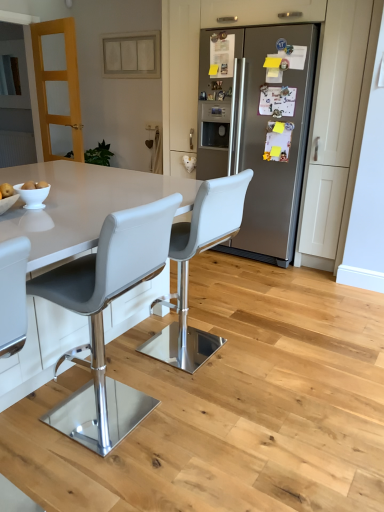
Question: Is the depth of satin silver refrigerator at center less than that of white leather stool at center, which appears as the 1th chair when viewed from the back?

Choices:
 (A) yes
 (B) no

Answer: (B)

Question: Are satin silver refrigerator at center and white leather stool at center, which appears as the 1th chair when viewed from the back, far apart?

Choices:
 (A) yes
 (B) no

Answer: (A)

Question: Can you confirm if satin silver refrigerator at center is positioned to the right of white leather stool at center, which appears as the 1th chair when viewed from the back?

Choices:
 (A) yes
 (B) no

Answer: (A)

Question: Does satin silver refrigerator at center touch white leather stool at center, which appears as the 1th chair when viewed from the back?

Choices:
 (A) no
 (B) yes

Answer: (A)

Question: Is satin silver refrigerator at center shorter than white leather stool at center, which is the 2th chair in front-to-back order?

Choices:
 (A) no
 (B) yes

Answer: (A)

Question: From the image's perspective, is satin silver refrigerator at center beneath white leather stool at center, which appears as the 1th chair when viewed from the back?

Choices:
 (A) no
 (B) yes

Answer: (A)

Question: From a real-world perspective, is white glossy bowl at lower left under yellow matte apple at lower left?

Choices:
 (A) no
 (B) yes

Answer: (B)

Question: From a real-world perspective, is white glossy bowl at lower left located higher than yellow matte apple at lower left?

Choices:
 (A) no
 (B) yes

Answer: (A)

Question: Considering the relative sizes of white glossy bowl at lower left and yellow matte apple at lower left in the image provided, is white glossy bowl at lower left wider than yellow matte apple at lower left?

Choices:
 (A) no
 (B) yes

Answer: (B)

Question: Are white glossy bowl at lower left and yellow matte apple at lower left making contact?

Choices:
 (A) no
 (B) yes

Answer: (B)

Question: Can you confirm if white glossy bowl at lower left is bigger than yellow matte apple at lower left?

Choices:
 (A) yes
 (B) no

Answer: (A)

Question: Is white glossy bowl at lower left at the left side of yellow matte apple at lower left?

Choices:
 (A) yes
 (B) no

Answer: (B)

Question: Is white leather stool at center, which is the 2th chair in front-to-back order, placed right next to white glossy bowl at lower left?

Choices:
 (A) yes
 (B) no

Answer: (B)